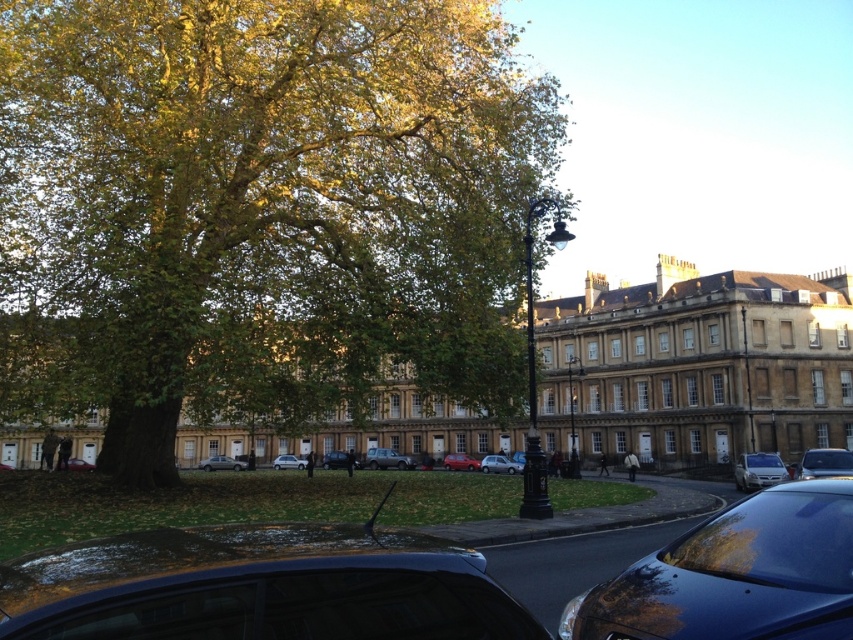
Question: Which of the following is the farthest from the observer?

Choices:
 (A) shiny black car at center
 (B) silver metallic van at lower right

Answer: (B)

Question: Is silver metallic car at center bigger than silver metallic sedan at center?

Choices:
 (A) yes
 (B) no

Answer: (B)

Question: Which point is farther from the camera taking this photo?

Choices:
 (A) (341, 452)
 (B) (64, 608)

Answer: (A)

Question: Can you confirm if shiny blue car at lower right is positioned above silver metallic car at center?

Choices:
 (A) no
 (B) yes

Answer: (B)

Question: Does metallic silver car at center appear over silver metallic hatchback at center?

Choices:
 (A) no
 (B) yes

Answer: (B)

Question: Which point is farther to the camera?

Choices:
 (A) (810, 499)
 (B) (277, 467)

Answer: (B)